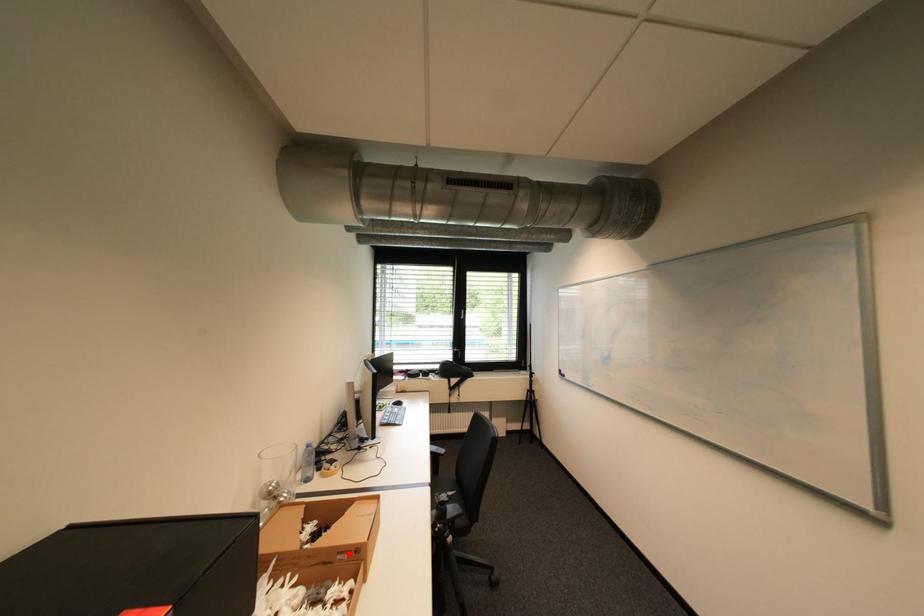
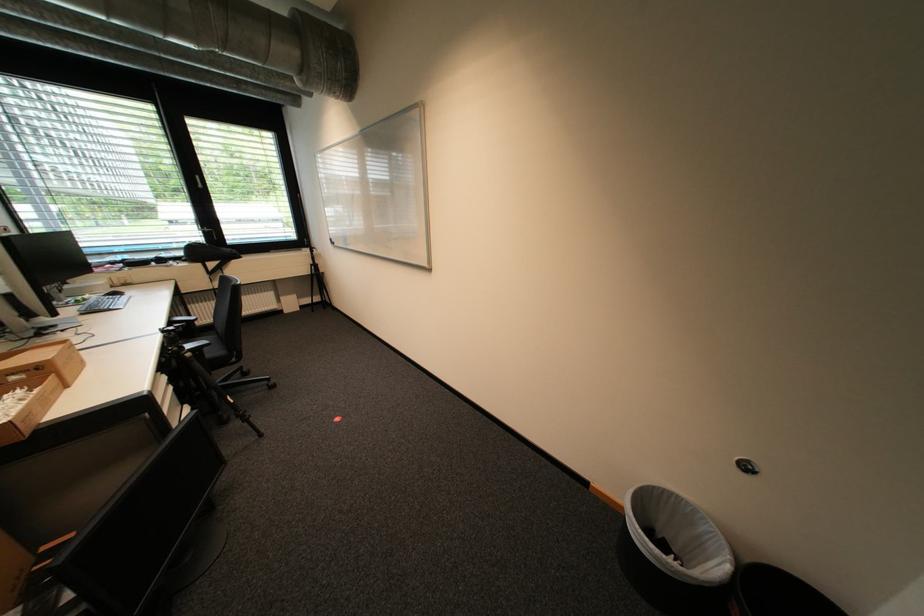
Question: I am providing you with two images of the same scene from different viewpoints. Image1 has a red point marked. In image2, the corresponding 3D location appears at what relative position? Reply with the corresponding letter.

Choices:
 (A) Closer
 (B) Farther

Answer: (B)